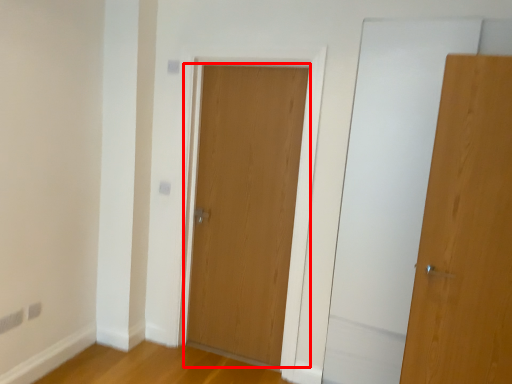
Question: From the image's perspective, where is door (annotated by the red box) located relative to door?

Choices:
 (A) below
 (B) above

Answer: (B)